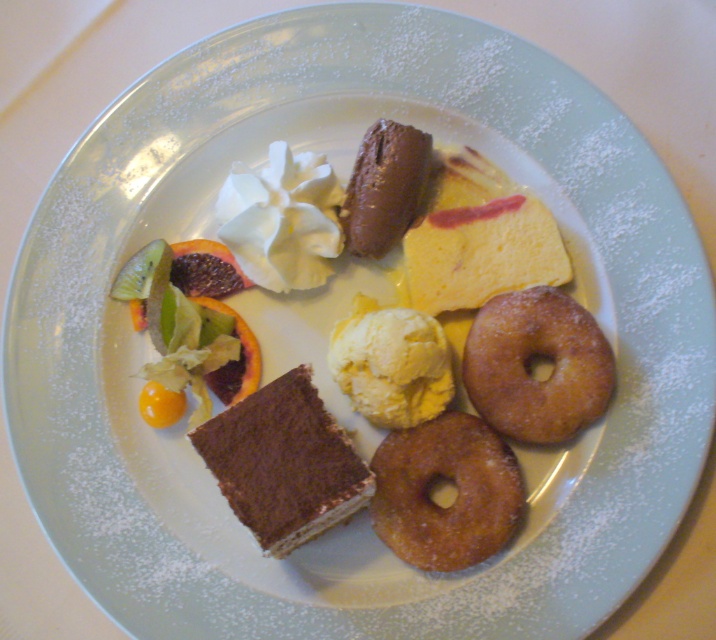
Between point (522, 348) and point (354, 177), which one is positioned behind?

Positioned behind is point (354, 177).

Between crispy golden donut at center and chocolate smoothie at center, which one is positioned higher?

chocolate smoothie at center is above.

This screenshot has width=716, height=640. What are the coordinates of `crispy golden donut at center` in the screenshot? It's located at (533, 365).

Is crispy golden donut at lower right taller than crispy golden donut at center?

No.

Does crispy golden donut at lower right appear over crispy golden donut at center?

No.

Which is in front, point (469, 424) or point (531, 362)?

Point (469, 424) is more forward.

Image resolution: width=716 pixels, height=640 pixels. In order to click on crispy golden donut at lower right in this screenshot , I will do `click(450, 484)`.

Measure the distance between dark brown sponge cake at center and yellow creamy ice cream at center.

dark brown sponge cake at center and yellow creamy ice cream at center are 4.88 inches apart from each other.

Does dark brown sponge cake at center appear over yellow creamy ice cream at center?

No.

Identify the location of dark brown sponge cake at center. The width and height of the screenshot is (716, 640). (x=284, y=464).